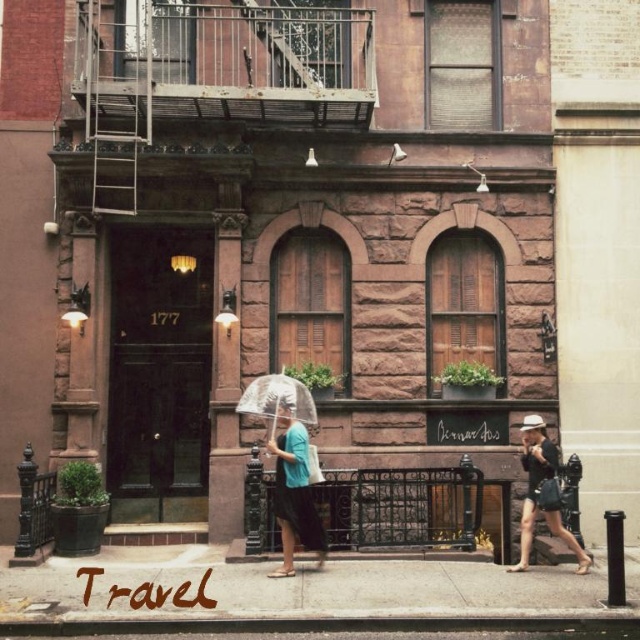
Who is more distant from viewer, [218,609] or [304,412]?

The point [304,412] is behind.

Looking at this image, is the position of smooth concrete pavement at center more distant than that of transparent plastic umbrella at center?

Yes, it is.

Does point (234, 588) lie in front of point (241, 397)?

Yes, point (234, 588) is in front of point (241, 397).

You are a GUI agent. You are given a task and a screenshot of the screen. Output one action in this format:
    pyautogui.click(x=<x>, y=<y>)
    Task: Click on the smooth concrete pavement at center
    
    Given the screenshot: What is the action you would take?
    (321, 588)

Is point (282, 419) less distant than point (307, 388)?

That is True.

Does matte blue shirt at center have a greater height compared to transparent plastic umbrella at center?

Yes.

Find the location of `matte blue shirt at center`. matte blue shirt at center is located at coordinates (294, 492).

Can you confirm if matte blue shirt at center is positioned to the left of matte black dress at lower right?

Correct, you'll find matte blue shirt at center to the left of matte black dress at lower right.

Is matte blue shirt at center closer to the viewer compared to matte black dress at lower right?

Yes, it is in front of matte black dress at lower right.

What do you see at coordinates (294, 492) in the screenshot?
I see `matte blue shirt at center` at bounding box center [294, 492].

The width and height of the screenshot is (640, 640). What are the coordinates of `matte blue shirt at center` in the screenshot? It's located at (294, 492).